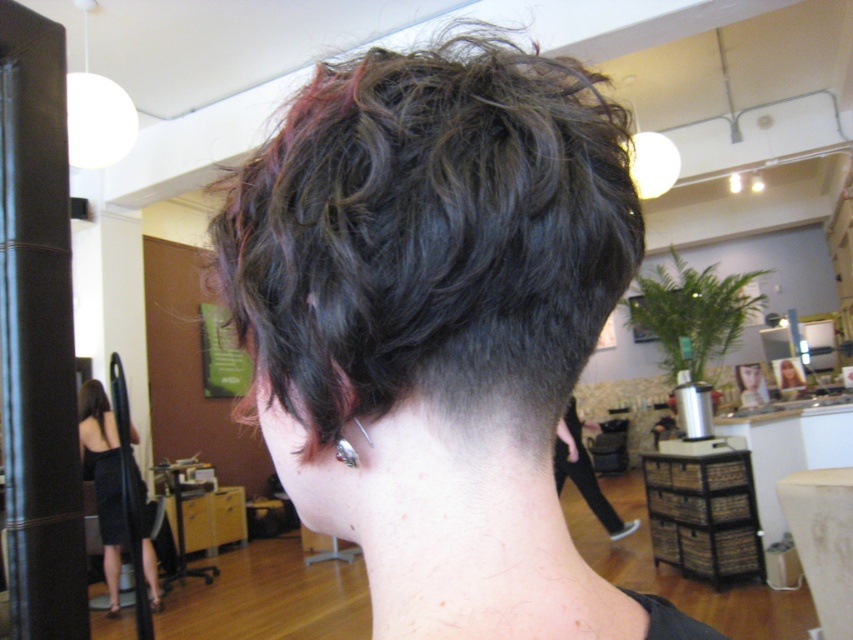
Question: Which is nearer to the black fabric barber at lower right?

Choices:
 (A) dark wavy hair at center
 (B) silver metallic earring at back

Answer: (A)

Question: Is black dress at left smaller than black fabric barber at lower right?

Choices:
 (A) no
 (B) yes

Answer: (B)

Question: Which object appears farthest from the camera in this image?

Choices:
 (A) silver metallic earring at back
 (B) black fabric barber at lower right

Answer: (B)

Question: Is black dress at left bigger than black fabric barber at lower right?

Choices:
 (A) no
 (B) yes

Answer: (A)

Question: From the image, what is the correct spatial relationship of dark wavy hair at center in relation to black dress at left?

Choices:
 (A) left
 (B) right

Answer: (B)

Question: Which point is farther to the camera?

Choices:
 (A) (120, 502)
 (B) (351, 467)
 (C) (456, 109)

Answer: (A)